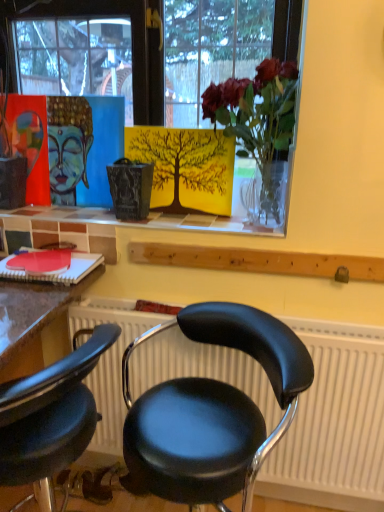
Question: Does black leather chair at center, which is the first chair from right to left, have a greater height compared to matte glass vase at upper center?

Choices:
 (A) yes
 (B) no

Answer: (A)

Question: Is black leather chair at center, which is the first chair from right to left, bigger than matte glass vase at upper center?

Choices:
 (A) no
 (B) yes

Answer: (B)

Question: Considering the relative sizes of black leather chair at center, which is the first chair from right to left, and matte glass vase at upper center in the image provided, is black leather chair at center, which is the first chair from right to left, shorter than matte glass vase at upper center?

Choices:
 (A) no
 (B) yes

Answer: (A)

Question: From a real-world perspective, is black leather chair at center, the 2th chair positioned from the left, physically above matte glass vase at upper center?

Choices:
 (A) yes
 (B) no

Answer: (B)

Question: Does black leather chair at center, the 2th chair positioned from the left, contain matte glass vase at upper center?

Choices:
 (A) no
 (B) yes

Answer: (A)

Question: Is matte acrylic painting of buddha head at upper left situated inside translucent glass vase at upper center or outside?

Choices:
 (A) inside
 (B) outside

Answer: (B)

Question: Looking at their shapes, would you say matte acrylic painting of buddha head at upper left is wider or thinner than translucent glass vase at upper center?

Choices:
 (A) thin
 (B) wide

Answer: (A)

Question: In the image, is matte acrylic painting of buddha head at upper left on the left side or the right side of translucent glass vase at upper center?

Choices:
 (A) right
 (B) left

Answer: (B)

Question: In terms of height, does matte acrylic painting of buddha head at upper left look taller or shorter compared to translucent glass vase at upper center?

Choices:
 (A) short
 (B) tall

Answer: (A)

Question: Relative to black leather chair at lower left, which is counted as the 1th chair, starting from the left, is black leather chair at center, which is the first chair from right to left, in front or behind?

Choices:
 (A) front
 (B) behind

Answer: (A)

Question: Would you say black leather chair at center, the 2th chair positioned from the left, is inside or outside black leather chair at lower left, which is counted as the 1th chair, starting from the left?

Choices:
 (A) outside
 (B) inside

Answer: (A)

Question: In the image, is black leather chair at center, the 2th chair positioned from the left, on the left side or the right side of black leather chair at lower left, marked as the 2th chair in a right-to-left arrangement?

Choices:
 (A) right
 (B) left

Answer: (A)

Question: From a real-world perspective, is black leather chair at center, the 2th chair positioned from the left, physically located above or below black leather chair at lower left, which is counted as the 1th chair, starting from the left?

Choices:
 (A) above
 (B) below

Answer: (A)

Question: In terms of size, does black leather chair at lower left, marked as the 2th chair in a right-to-left arrangement, appear bigger or smaller than translucent glass vase at upper center?

Choices:
 (A) small
 (B) big

Answer: (B)

Question: Is black leather chair at lower left, which is counted as the 1th chair, starting from the left, situated inside translucent glass vase at upper center or outside?

Choices:
 (A) inside
 (B) outside

Answer: (B)